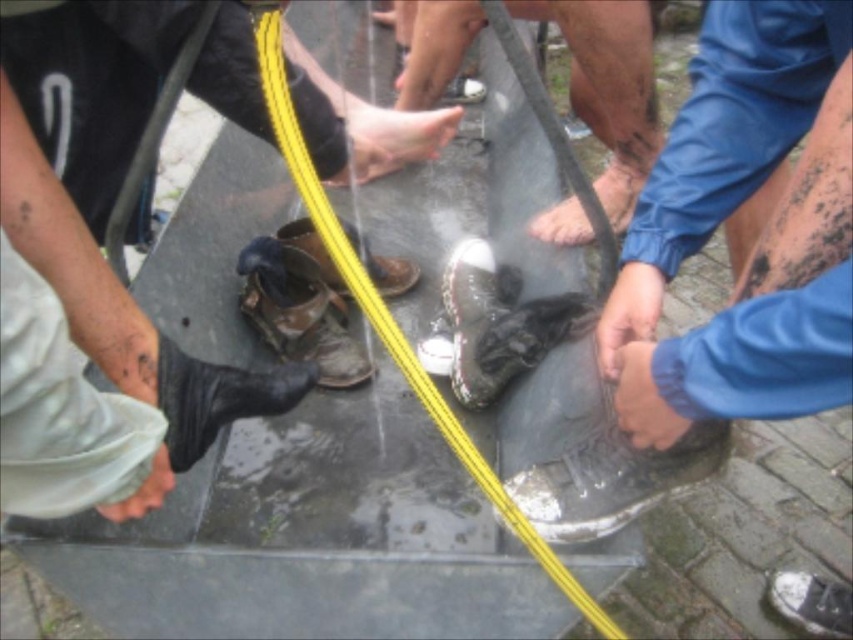
In the scene shown: You are standing in the courtyard and see two shoes being cleaned with a hose. Which shoe is positioned to the right of the other? The shiny black shoe at center and the shiny metallic shoe at center are both in view. Please identify which one is on the right.

The shiny black shoe at center is positioned to the right of the shiny metallic shoe at center, so the shiny black shoe at center is on the right side.

You are a photographer trying to capture a closeup of both the smooth skin foot at center and the camouflage fabric boot at lower left in the scene. Since the foot is wider, how should you adjust your camera framing to include both objects without cropping either?

Since the smooth skin foot at center is wider than the camouflage fabric boot at lower left, you should position the camera framing to focus on the center area where the wider foot is located, ensuring both objects are fully visible within the frame.

Based on the photo, you are standing in the scene and want to clean your shoes. You see the shiny metallic boot at center and the shiny metallic shoe at center. Which one is located to the right when viewed from your perspective?

The shiny metallic boot at center is located to the right of the shiny metallic shoe at center.